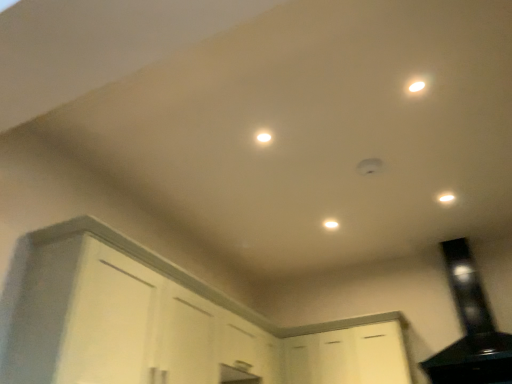
Question: From the image's perspective, is black glossy exhaust hood at upper right located beneath white matte light fixture at center?

Choices:
 (A) no
 (B) yes

Answer: (B)

Question: Considering the relative positions of black glossy exhaust hood at upper right and white matte light fixture at center in the image provided, is black glossy exhaust hood at upper right to the left of white matte light fixture at center from the viewer's perspective?

Choices:
 (A) yes
 (B) no

Answer: (B)

Question: Is black glossy exhaust hood at upper right in contact with white matte light fixture at center?

Choices:
 (A) yes
 (B) no

Answer: (B)

Question: Is black glossy exhaust hood at upper right not close to white matte light fixture at center?

Choices:
 (A) yes
 (B) no

Answer: (A)

Question: Can you confirm if black glossy exhaust hood at upper right is wider than white matte light fixture at center?

Choices:
 (A) yes
 (B) no

Answer: (A)

Question: Does black glossy exhaust hood at upper right come in front of white matte light fixture at center?

Choices:
 (A) no
 (B) yes

Answer: (B)

Question: Does black glossy exhaust hood at upper right have a lesser height compared to white glossy light at upper right, the third light viewed from the front?

Choices:
 (A) yes
 (B) no

Answer: (B)

Question: Is black glossy exhaust hood at upper right at the right side of white glossy light at upper right, which is the first light in right-to-left order?

Choices:
 (A) no
 (B) yes

Answer: (B)

Question: Is black glossy exhaust hood at upper right facing towards white glossy light at upper right, placed as the 3th light when sorted from top to bottom?

Choices:
 (A) yes
 (B) no

Answer: (A)

Question: Is black glossy exhaust hood at upper right oriented away from white glossy light at upper right, which ranks as the 3th light in left-to-right order?

Choices:
 (A) no
 (B) yes

Answer: (A)

Question: Is black glossy exhaust hood at upper right positioned far away from white glossy light at upper right, the 1th light from the back?

Choices:
 (A) yes
 (B) no

Answer: (A)

Question: Can you confirm if black glossy exhaust hood at upper right is wider than white glossy light at upper right, which is the first light in right-to-left order?

Choices:
 (A) no
 (B) yes

Answer: (B)

Question: Considering the relative sizes of white glossy light at upper right, the third light viewed from the front, and white matte light fixture at center in the image provided, is white glossy light at upper right, the third light viewed from the front, shorter than white matte light fixture at center?

Choices:
 (A) no
 (B) yes

Answer: (A)